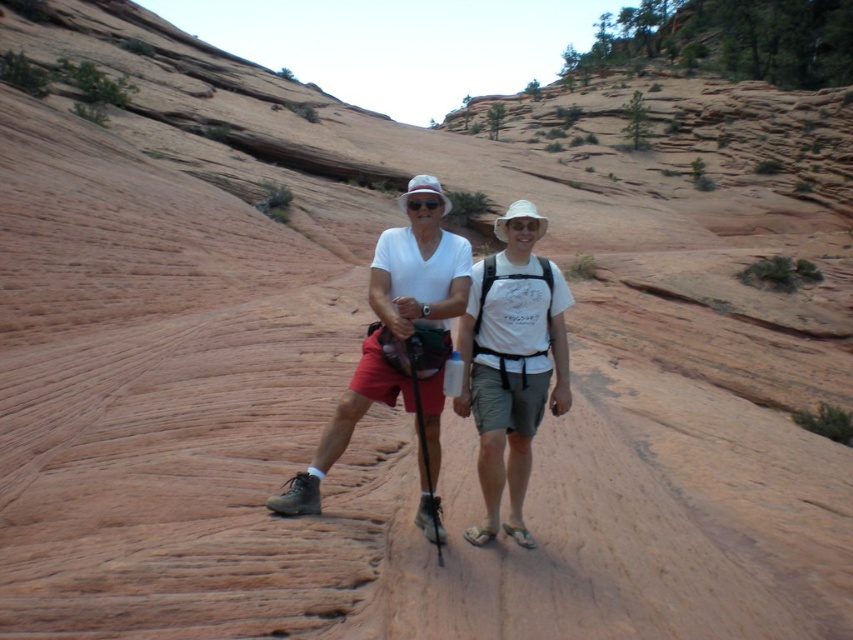
Question: Which point is farther from the camera taking this photo?

Choices:
 (A) (392, 292)
 (B) (451, 401)

Answer: (B)

Question: Can you confirm if matte white t-shirt at center is smaller than white cotton t-shirt at center?

Choices:
 (A) no
 (B) yes

Answer: (A)

Question: Is matte white t-shirt at center closer to the viewer compared to white cotton t-shirt at center?

Choices:
 (A) no
 (B) yes

Answer: (B)

Question: Is matte white t-shirt at center further to camera compared to white cotton t-shirt at center?

Choices:
 (A) no
 (B) yes

Answer: (A)